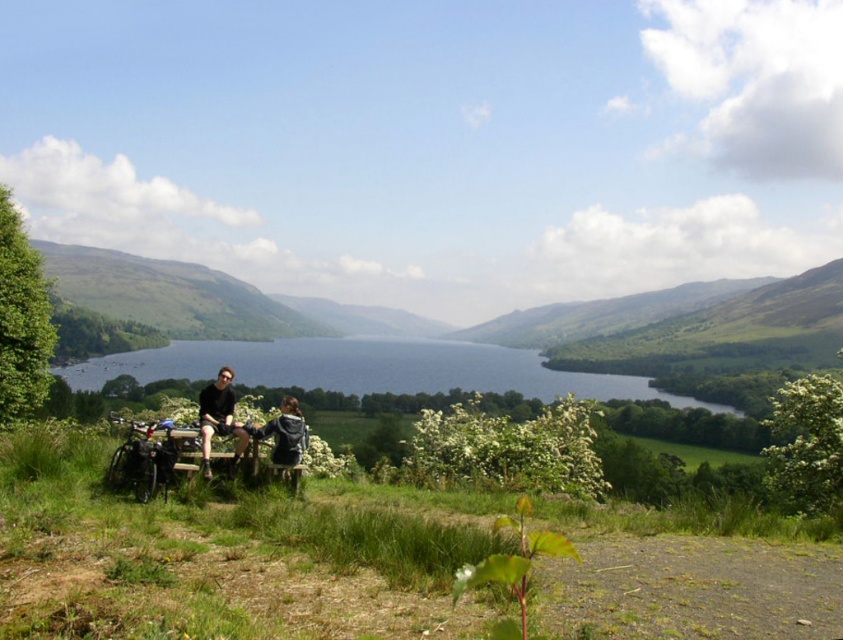
From the picture: You are planning to take a photo of the blue water at center and dark blue jeans at center. Which object will appear bigger in the photo?

The blue water at center will appear bigger in the photo because it has a larger size compared to the dark blue jeans at center.

You are standing at the point labeled as point [247,424] in the image. What object is located exactly at this coordinate?

The point [247,424] corresponds to dark blue jeans at center.